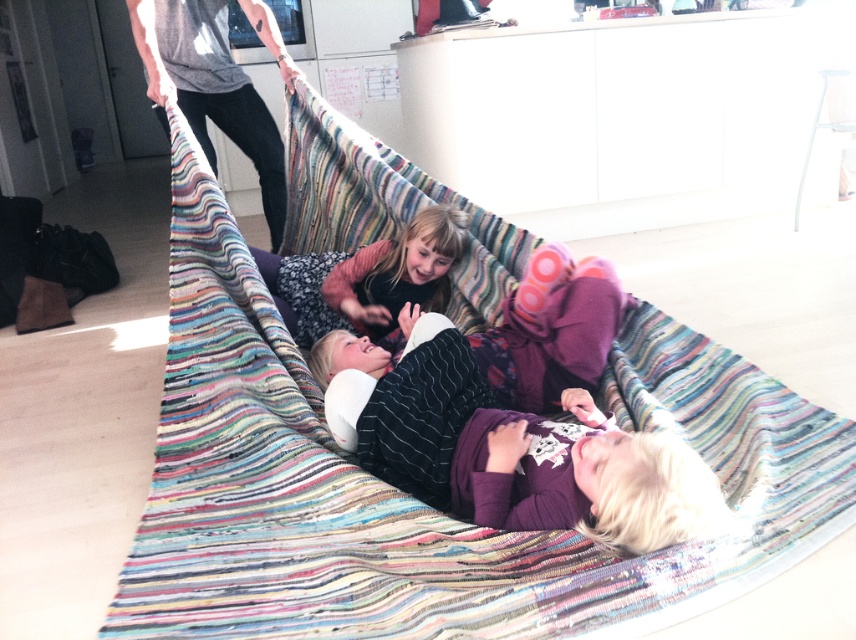
Measure the distance between purple soft fabric at center and matte black shirt at center.

purple soft fabric at center is 69.47 centimeters from matte black shirt at center.

The image size is (856, 640). In order to click on purple soft fabric at center in this screenshot , I will do `click(510, 449)`.

Locate an element on the screen. purple soft fabric at center is located at coordinates (510, 449).

In order to click on purple soft fabric at center in this screenshot , I will do `click(510, 449)`.